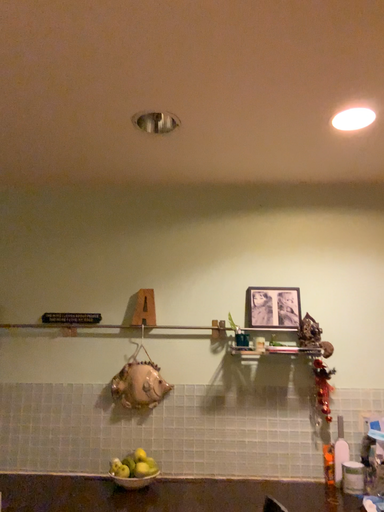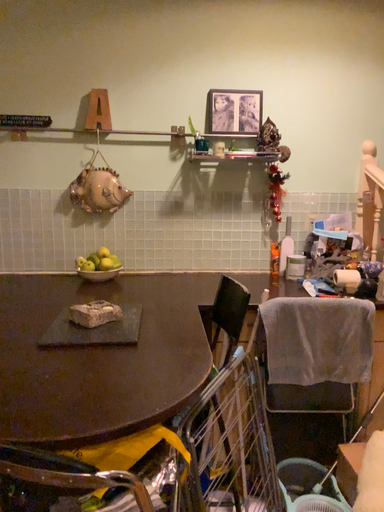
Question: Which way did the camera rotate in the video?

Choices:
 (A) rotated right
 (B) rotated left

Answer: (A)